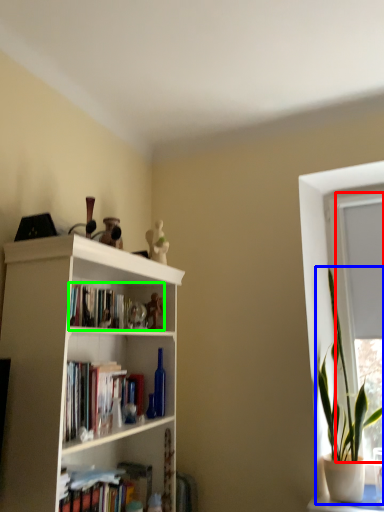
Question: Estimate the real-world distances between objects in this image. Which object is farther from window frame (highlighted by a red box), houseplant (highlighted by a blue box) or book (highlighted by a green box)?

Choices:
 (A) houseplant
 (B) book

Answer: (B)